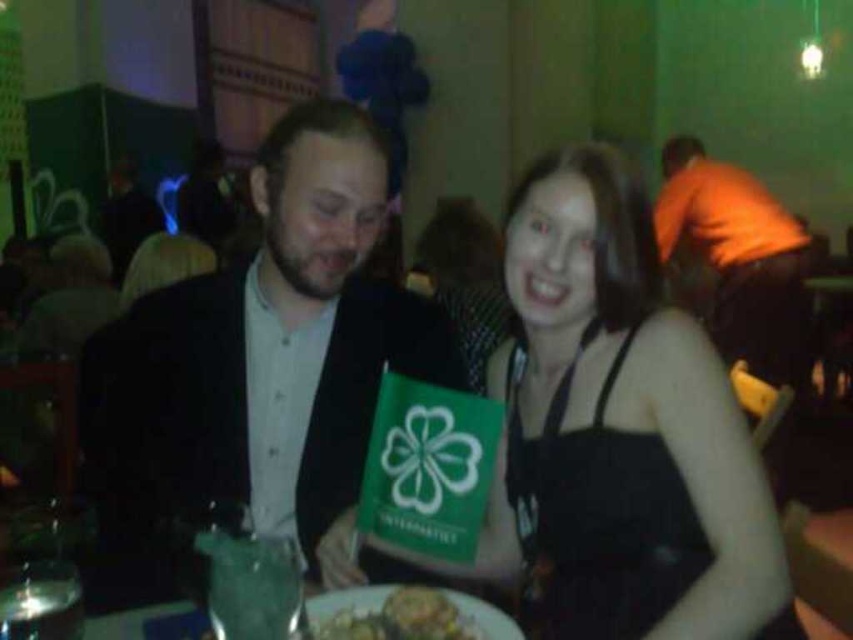
Question: Which point is farther to the camera?

Choices:
 (A) (312, 496)
 (B) (694, 369)

Answer: (A)

Question: Is matte green flag at center thinner than yellowish matte plate at lower center?

Choices:
 (A) yes
 (B) no

Answer: (B)

Question: Is matte green flag at center further to the viewer compared to orange fabric shirt at upper right?

Choices:
 (A) yes
 (B) no

Answer: (B)

Question: In this image, where is matte green flag at center located relative to yellowish matte plate at lower center?

Choices:
 (A) left
 (B) right

Answer: (B)

Question: Estimate the real-world distances between objects in this image. Which object is farther from the matte green flag at center?

Choices:
 (A) yellowish matte plate at lower center
 (B) orange fabric shirt at upper right
 (C) matte black suit at center

Answer: (B)

Question: Which object is positioned farthest from the matte black suit at center?

Choices:
 (A) yellowish matte plate at lower center
 (B) orange fabric shirt at upper right

Answer: (B)